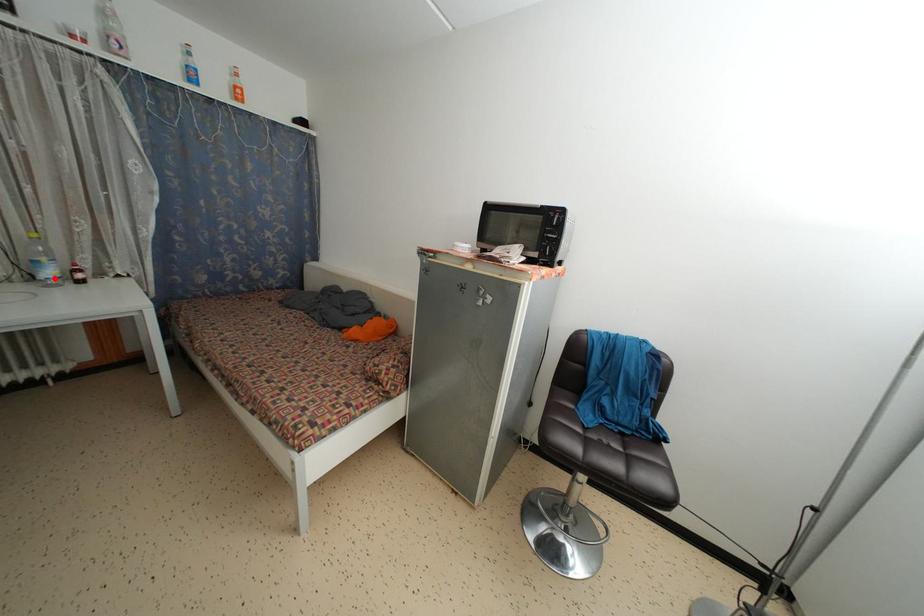
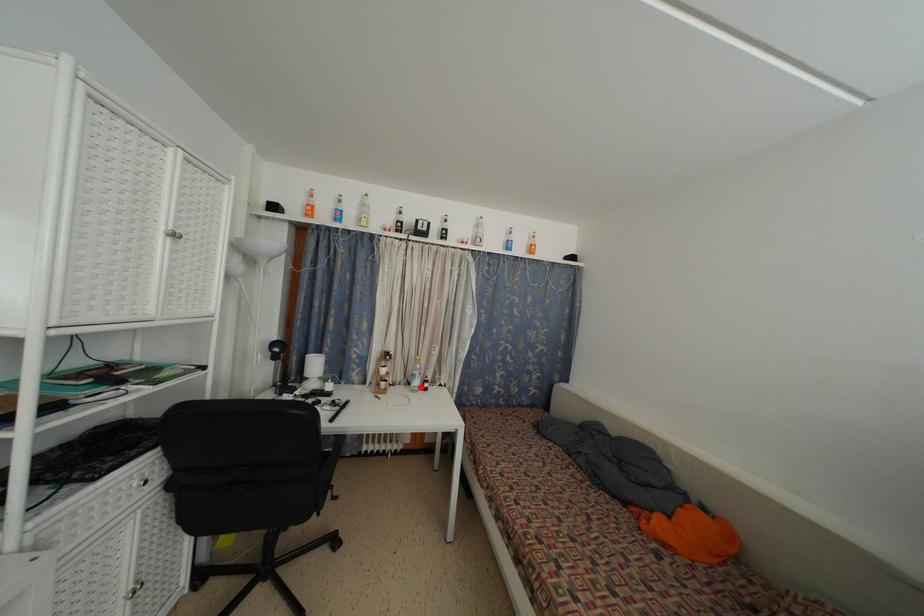
I am providing you with two images of the same scene from different viewpoints. A red point is marked on the first image and another point is marked on the second image. Is the marked point in image1 the same physical position as the marked point in image2?

Yes